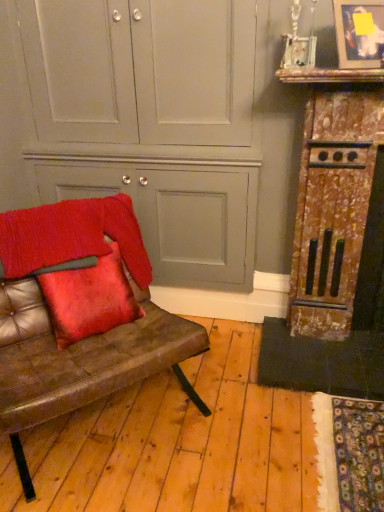
Question: Considering their positions, is rusty metal fireplace at right, which ranks as the second dresser in left-to-right order, located in front of or behind leather couch at left?

Choices:
 (A) front
 (B) behind

Answer: (B)

Question: Considering the relative positions of rusty metal fireplace at right, which ranks as the second dresser in left-to-right order, and leather couch at left in the image provided, is rusty metal fireplace at right, which ranks as the second dresser in left-to-right order, to the left or to the right of leather couch at left?

Choices:
 (A) left
 (B) right

Answer: (B)

Question: Estimate the real-world distances between objects in this image. Which object is closer to the velvety red blanket at left?

Choices:
 (A) rusty metal fireplace at right, marked as the first dresser in a right-to-left arrangement
 (B) velvet red pillow at left
 (C) matte gray cabinet at center, which appears as the second dresser when viewed from the right
 (D) metallic silver picture frame at upper right
 (E) leather couch at left

Answer: (B)

Question: Which object is positioned farthest from the matte gray cabinet at center, placed as the first dresser when sorted from left to right?

Choices:
 (A) leather couch at left
 (B) rusty metal fireplace at right, marked as the first dresser in a right-to-left arrangement
 (C) velvet red pillow at left
 (D) metallic silver picture frame at upper right
 (E) velvety red blanket at left

Answer: (D)